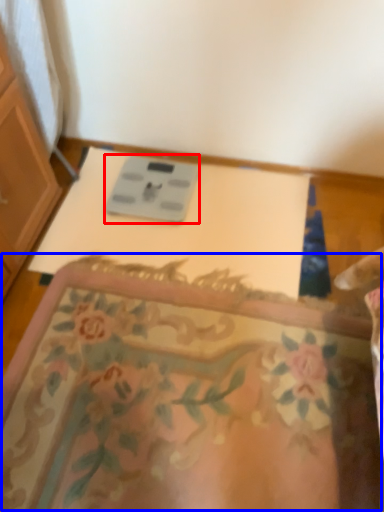
Question: Among these objects, which one is nearest to the camera, scale (highlighted by a red box) or mat (highlighted by a blue box)?

Choices:
 (A) scale
 (B) mat

Answer: (B)